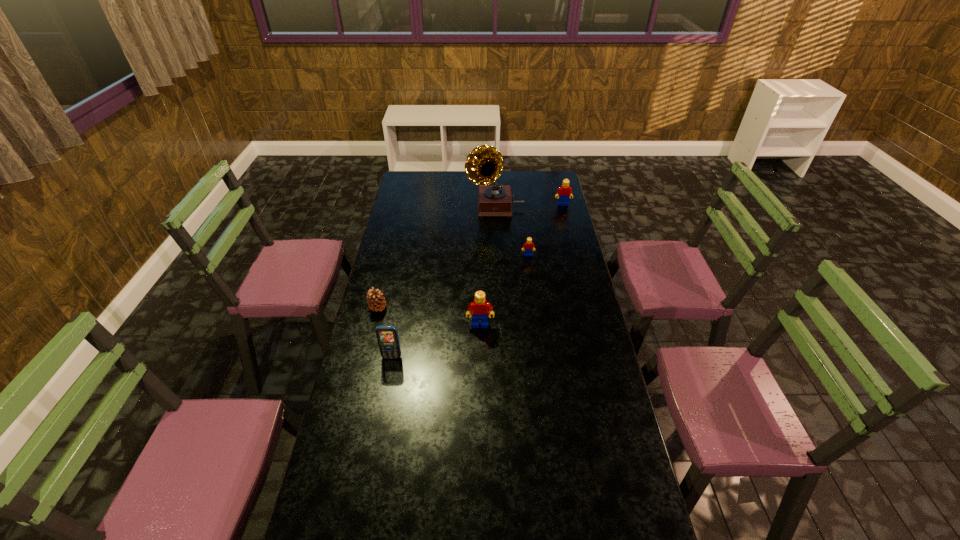
What are the coordinates of `the third nearest object` in the screenshot? It's located at (376, 302).

You are a GUI agent. You are given a task and a screenshot of the screen. Output one action in this format:
    pyautogui.click(x=<x>, y=<y>)
    Task: Click on the free space located 0.180m on the front-facing side of the nearest Lego
    
    Given the screenshot: What is the action you would take?
    pyautogui.click(x=480, y=367)

Locate an element on the screen. vacant space located 0.090m on the front-facing side of the second farthest Lego is located at coordinates (530, 269).

The height and width of the screenshot is (540, 960). In order to click on vacant space located 0.330m on the front-facing side of the rightmost object in this screenshot , I will do `click(573, 244)`.

At what (x,y) coordinates should I click in order to perform the action: click on vacant space located 0.270m from the horn of the phonograph record. Please return your answer as a coordinate pair (x, y). The height and width of the screenshot is (540, 960). Looking at the image, I should click on (415, 207).

Locate an element on the screen. vacant space situated 0.220m from the horn of the phonograph record is located at coordinates (424, 207).

The height and width of the screenshot is (540, 960). Find the location of `blank space located from the horn of the phonograph record`. blank space located from the horn of the phonograph record is located at coordinates (399, 207).

This screenshot has width=960, height=540. I want to click on vacant space located 0.080m on the screen of the second object from left to right, so click(388, 379).

This screenshot has width=960, height=540. In order to click on free space located on the back of the leftmost object in this screenshot , I will do `click(386, 276)`.

The image size is (960, 540). In order to click on cellular telephone that is positioned at the left edge in this screenshot , I will do `click(387, 336)`.